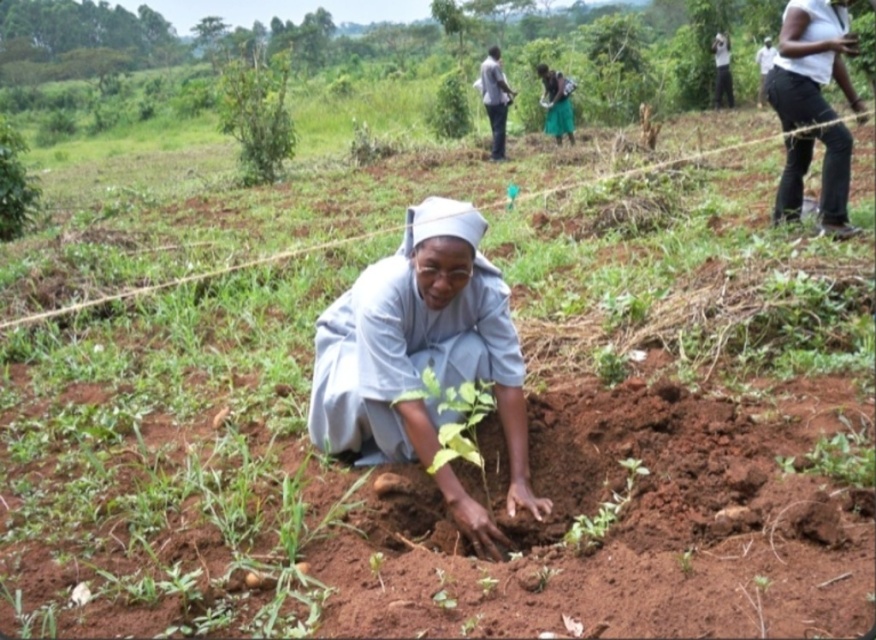
Question: Estimate the real-world distances between objects in this image. Which object is farther from the green leafy plant at center?

Choices:
 (A) white clothed person at upper right
 (B) dark gray shirt at upper center
 (C) light gray fabric at center

Answer: (A)

Question: Can you confirm if dark gray shirt at upper center is positioned to the left of green fabric dress at upper center?

Choices:
 (A) yes
 (B) no

Answer: (A)

Question: Is light gray fabric at center thinner than dark gray shirt at upper center?

Choices:
 (A) yes
 (B) no

Answer: (B)

Question: Is light gray fabric at center wider than white clothed person at upper right?

Choices:
 (A) no
 (B) yes

Answer: (B)

Question: Which object is farther from the camera taking this photo?

Choices:
 (A) white clothed person at upper right
 (B) light gray fabric at center

Answer: (A)

Question: Which point is closer to the camera?

Choices:
 (A) coord(496,81)
 (B) coord(436,275)
 (C) coord(716,99)
 (D) coord(557,109)

Answer: (B)